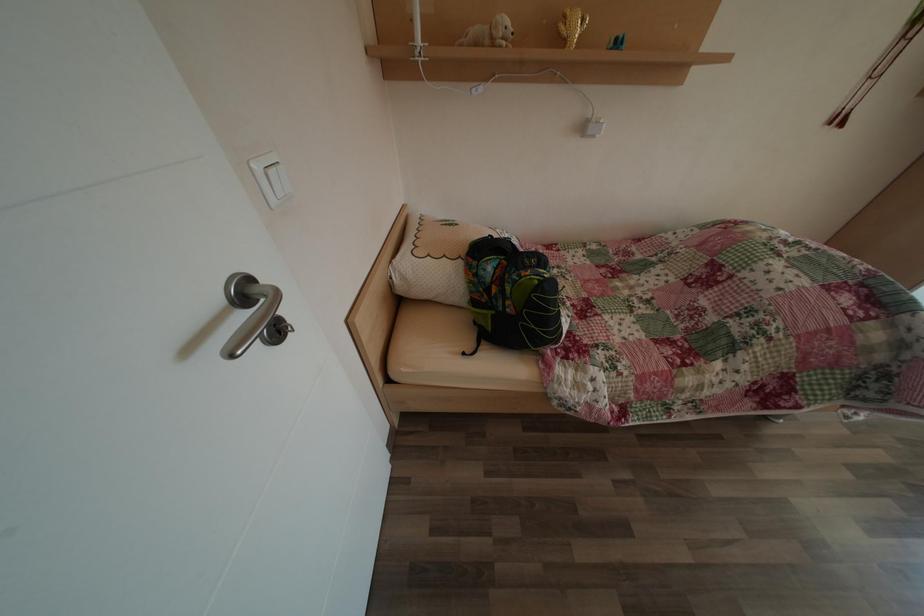
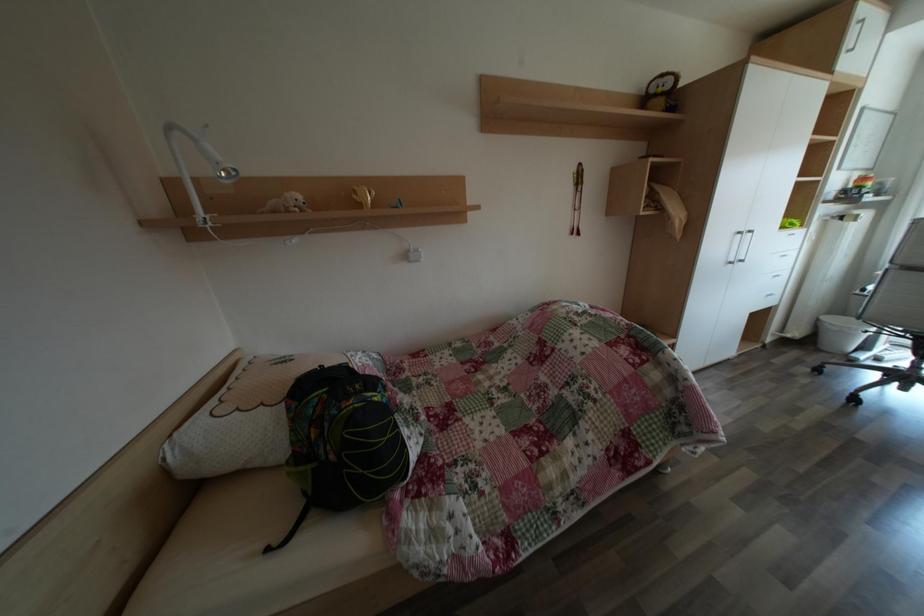
How did the camera likely rotate?

The camera's rotation is toward right-up.